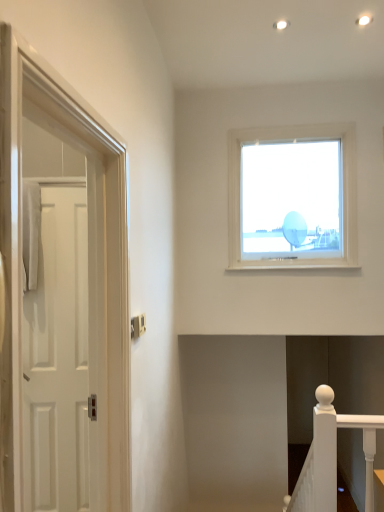
The width and height of the screenshot is (384, 512). Identify the location of transparent glass window at upper center. (292, 197).

Describe the element at coordinates (292, 197) in the screenshot. I see `transparent glass window at upper center` at that location.

Find the location of a particular element. The width and height of the screenshot is (384, 512). transparent glass window at upper center is located at coordinates click(292, 197).